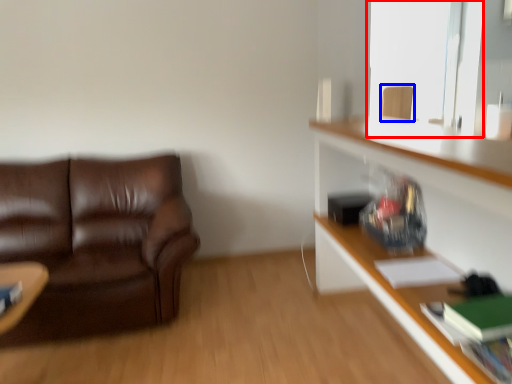
Question: Which of the following is the closest to the observer, window screen (highlighted by a red box) or swivel chair (highlighted by a blue box)?

Choices:
 (A) window screen
 (B) swivel chair

Answer: (B)